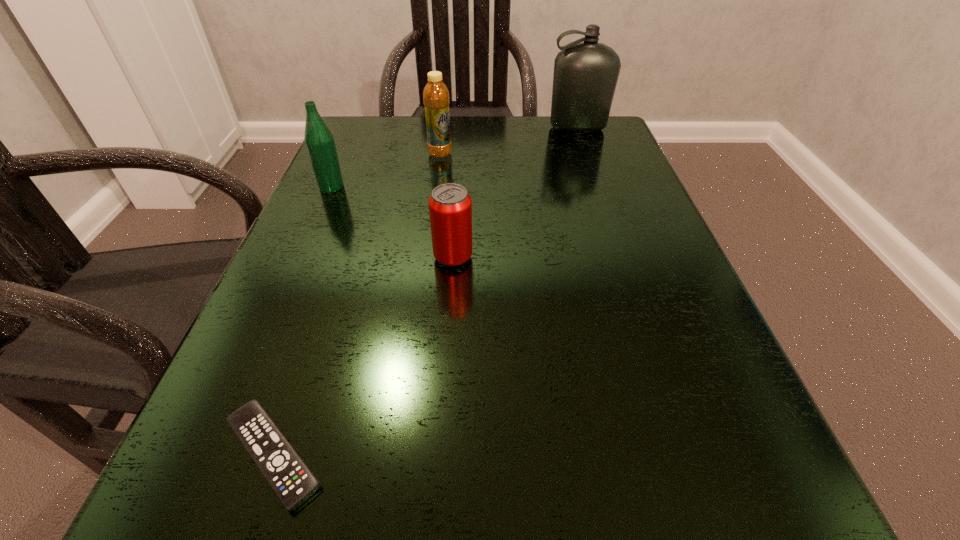
Locate an element on the screen. The height and width of the screenshot is (540, 960). the farthest bottle is located at coordinates (585, 76).

Where is `the tallest object`? This screenshot has height=540, width=960. the tallest object is located at coordinates (585, 76).

This screenshot has width=960, height=540. Identify the location of the second farthest bottle. (436, 99).

Find the location of `the second bottle from right to left`. the second bottle from right to left is located at coordinates (436, 99).

Image resolution: width=960 pixels, height=540 pixels. Find the location of `the nearest bottle`. the nearest bottle is located at coordinates [x=319, y=141].

This screenshot has height=540, width=960. Identify the location of the third nearest object. (319, 141).

Identify the location of the second nearest object. Image resolution: width=960 pixels, height=540 pixels. (450, 206).

Identify the location of the second shortest object. The image size is (960, 540). (450, 206).

Locate an element on the screen. the shortest object is located at coordinates [x=290, y=478].

Identify the location of the nearest object. (290, 478).